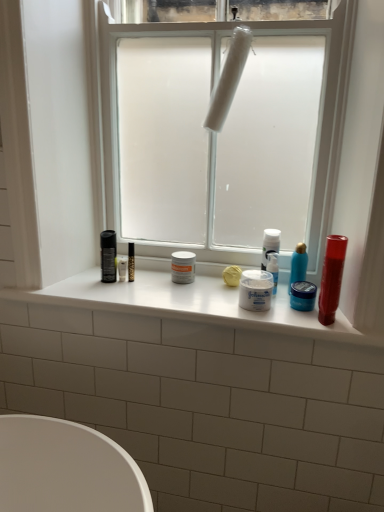
Image resolution: width=384 pixels, height=512 pixels. What are the coordinates of `vacant location below white frosted glass window at center (from a real-world perspective)` in the screenshot? It's located at (249, 314).